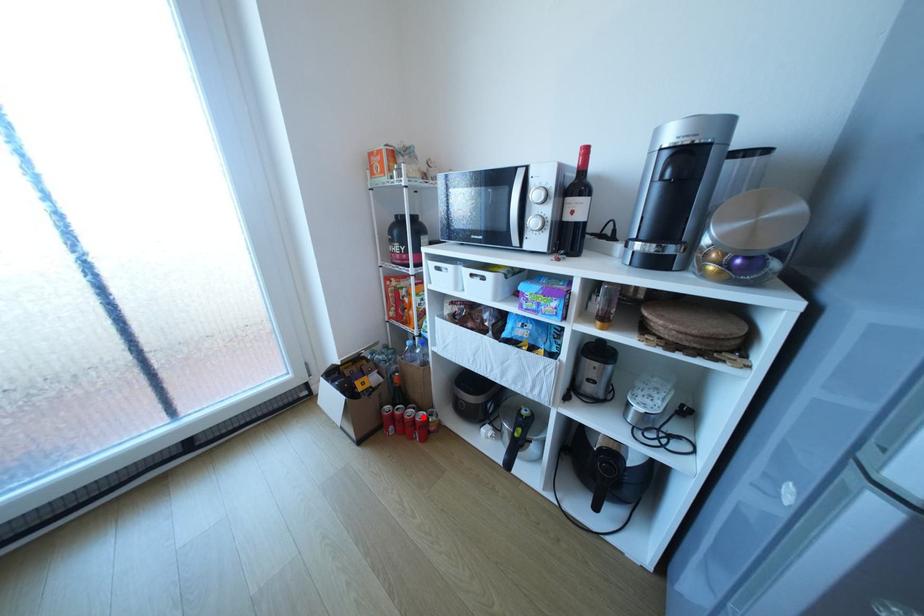
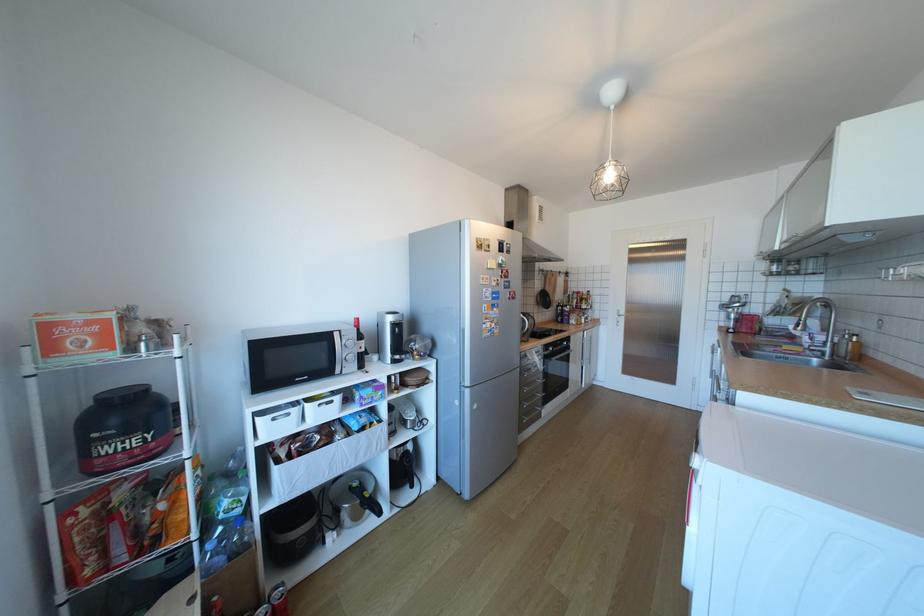
Question: I am providing you with two images of the same scene from different viewpoints. In image1, a red point is highlighted. Considering the same 3D point in image2, which of the following is correct?

Choices:
 (A) It is closer
 (B) It is farther

Answer: (A)